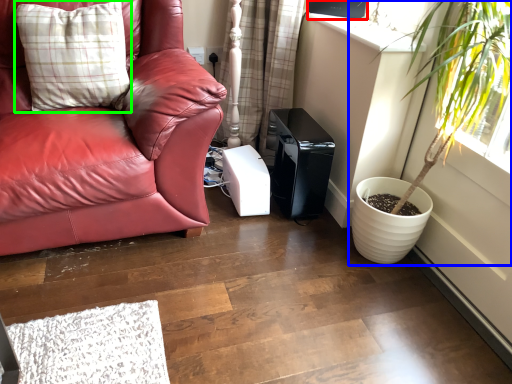
Question: Estimate the real-world distances between objects in this image. Which object is closer to window screen (highlighted by a red box), houseplant (highlighted by a blue box) or pillow (highlighted by a green box)?

Choices:
 (A) houseplant
 (B) pillow

Answer: (A)